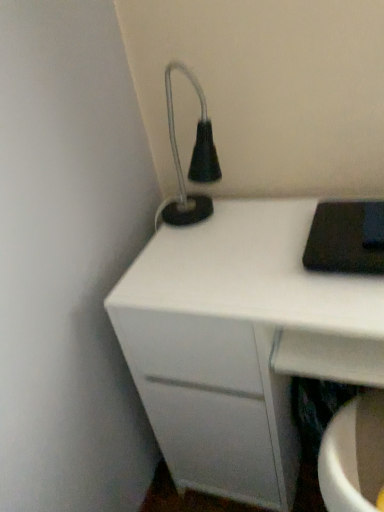
What do you see at coordinates (238, 342) in the screenshot? Image resolution: width=384 pixels, height=512 pixels. I see `white matte chest of drawers at center` at bounding box center [238, 342].

This screenshot has height=512, width=384. Find the location of `white matte chest of drawers at center`. white matte chest of drawers at center is located at coordinates (238, 342).

Measure the distance between point (173, 331) and camera.

Point (173, 331) and camera are 34.02 inches apart from each other.

Based on the photo, in order to face white matte chest of drawers at center, should I rotate leftwards or rightwards?

To face it directly, rotate right by 11.044 degrees.

The height and width of the screenshot is (512, 384). I want to click on white matte chest of drawers at center, so click(238, 342).